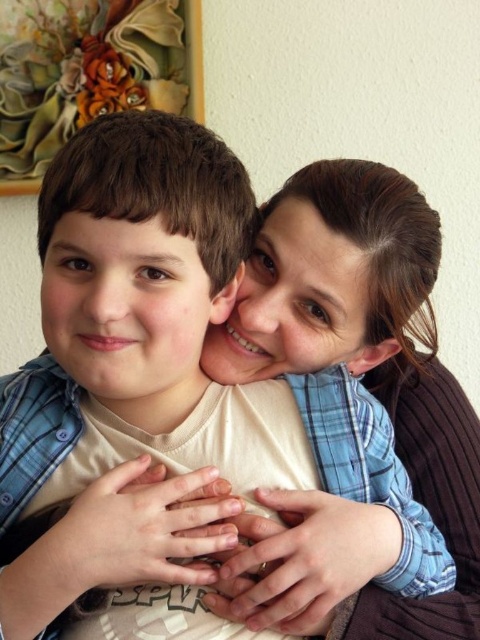
You are an interior designer assessing the wall layout in this living room. You notice the matte brown hair at upper center and the painted floral artwork at upper left. Which object occupies a higher position on the wall?

The matte brown hair at upper center is much taller than the painted floral artwork at upper left, so it occupies a higher position on the wall.